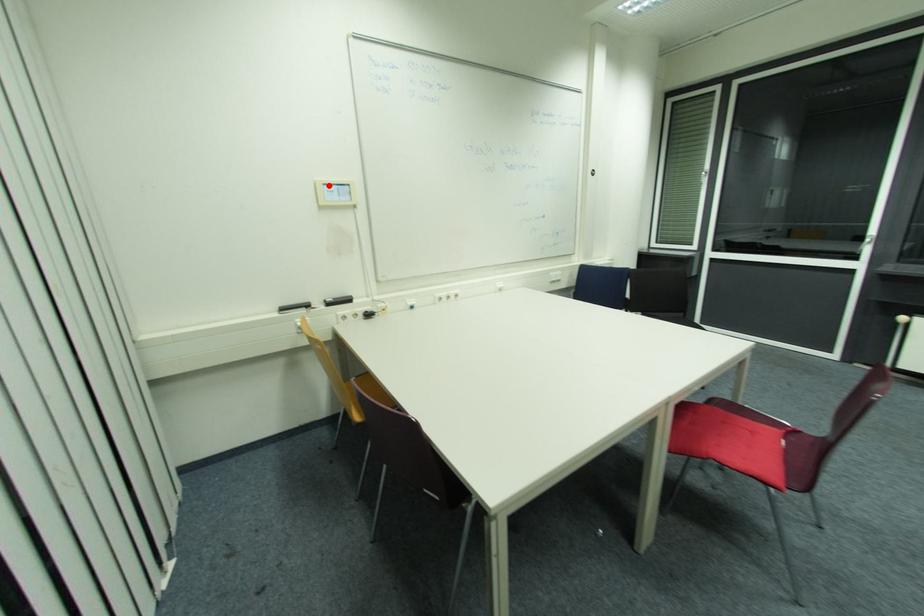
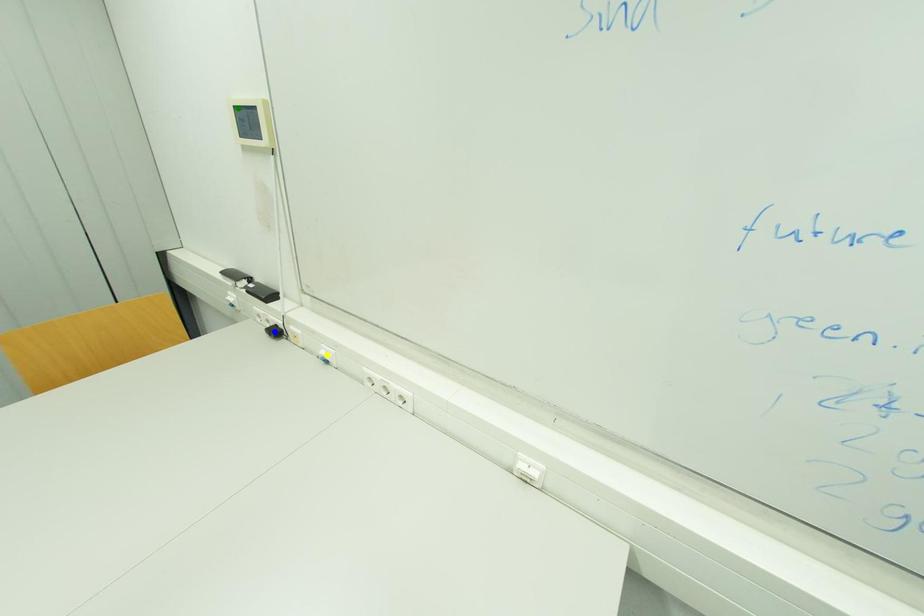
Question: I am providing you with two images of the same scene from different viewpoints. A red point is marked on the first image. You are given multiple points on the second image. Which spot in image 2 lines up with the point in image 1?

Choices:
 (A) green point
 (B) yellow point
 (C) blue point

Answer: (A)